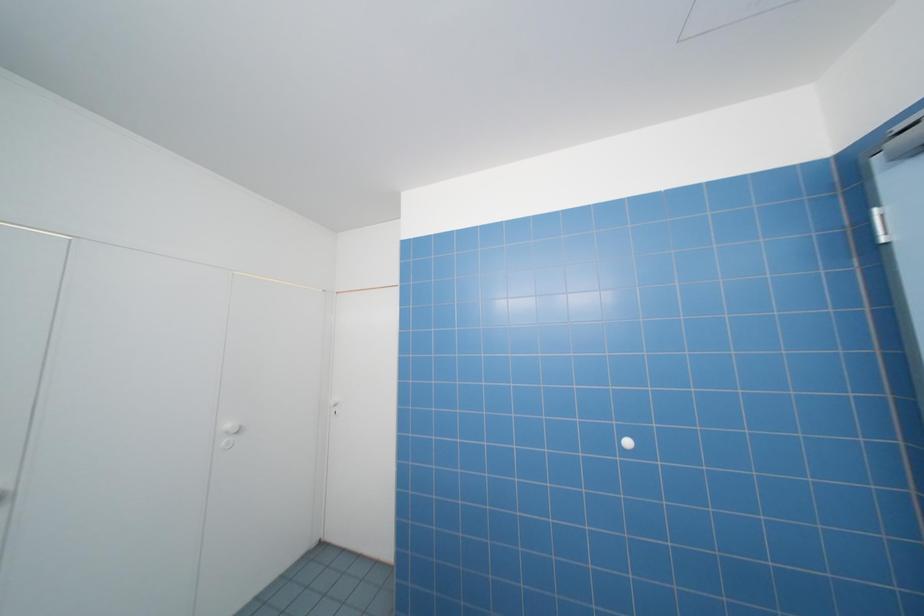
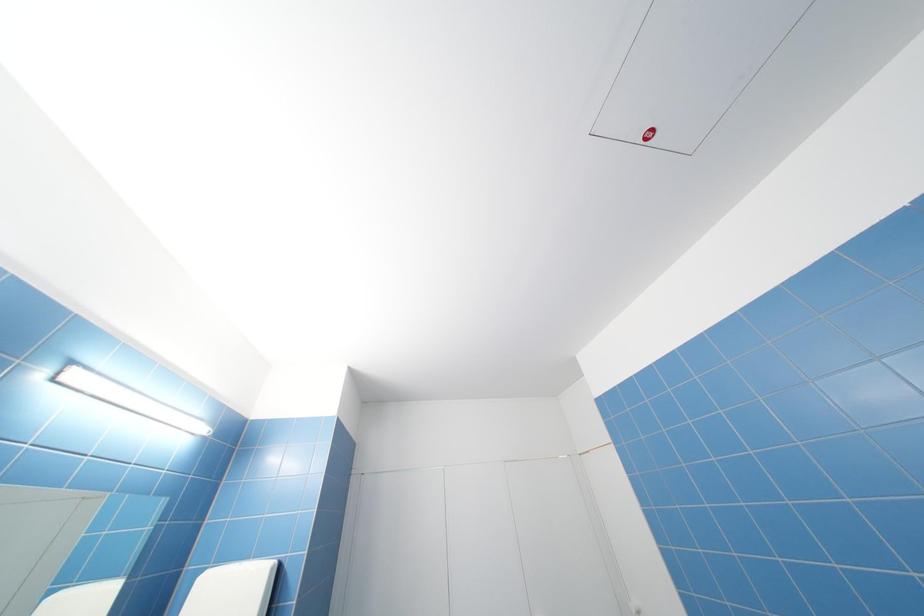
How did the camera likely rotate?

The camera's rotation is toward left-up.